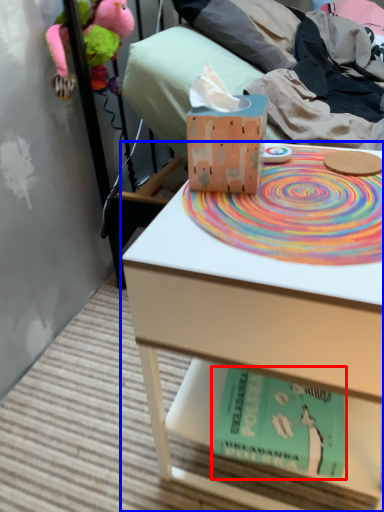
Question: Which object appears farthest to the camera in this image, paperback book (highlighted by a red box) or table (highlighted by a blue box)?

Choices:
 (A) paperback book
 (B) table

Answer: (A)